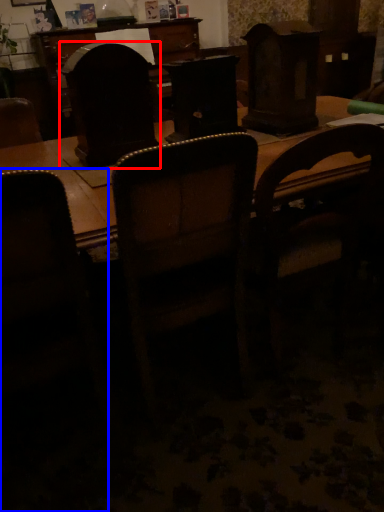
Question: Which of the following is the farthest to the observer, swivel chair (highlighted by a red box) or chair (highlighted by a blue box)?

Choices:
 (A) swivel chair
 (B) chair

Answer: (A)